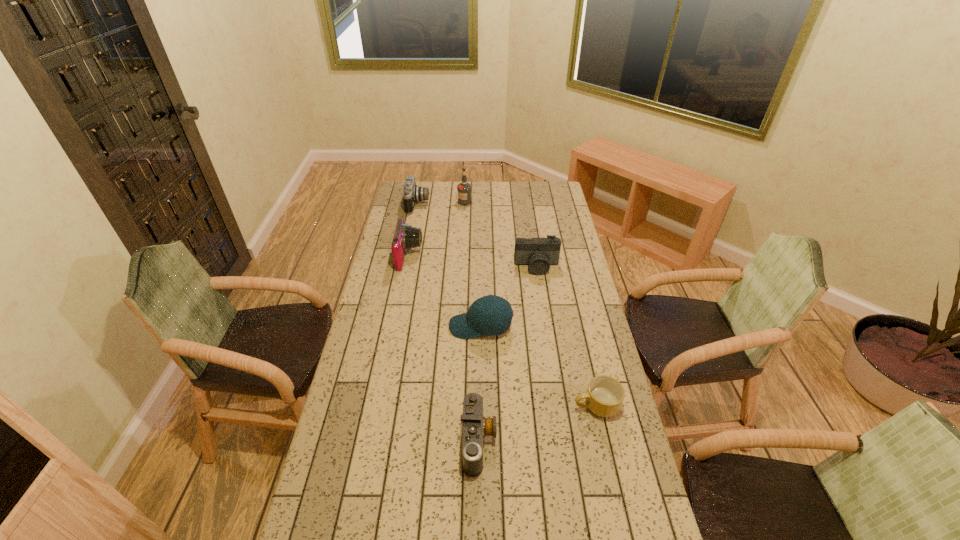
Find the location of a particular element. This screenshot has height=540, width=960. mug that is positioned at the right edge is located at coordinates (604, 397).

I want to click on object that is at the far left corner, so click(412, 193).

The image size is (960, 540). I want to click on vacant area at the far edge of the desktop, so click(525, 183).

Image resolution: width=960 pixels, height=540 pixels. In the image, there is a desktop. In order to click on vacant region at the left edge in this screenshot , I will do `click(386, 301)`.

Find the location of a particular element. The height and width of the screenshot is (540, 960). vacant space at the right edge of the desktop is located at coordinates (636, 537).

You are a GUI agent. You are given a task and a screenshot of the screen. Output one action in this format:
    pyautogui.click(x=<x>, y=<y>)
    Task: Click on the unoccupied position between the baseball cap and the rightmost camera
    This screenshot has width=960, height=540.
    Given the screenshot: What is the action you would take?
    pyautogui.click(x=509, y=296)

I want to click on free point between the tallest object and the rightmost camera, so click(501, 234).

Find the location of `unoccupied position between the fifth farthest object and the mug`. unoccupied position between the fifth farthest object and the mug is located at coordinates (539, 366).

Identify the location of object that ranks as the fourth closest to the farthest camera. The width and height of the screenshot is (960, 540). (490, 315).

Identify the location of object that stands as the closest to the rightmost camera. This screenshot has height=540, width=960. click(490, 315).